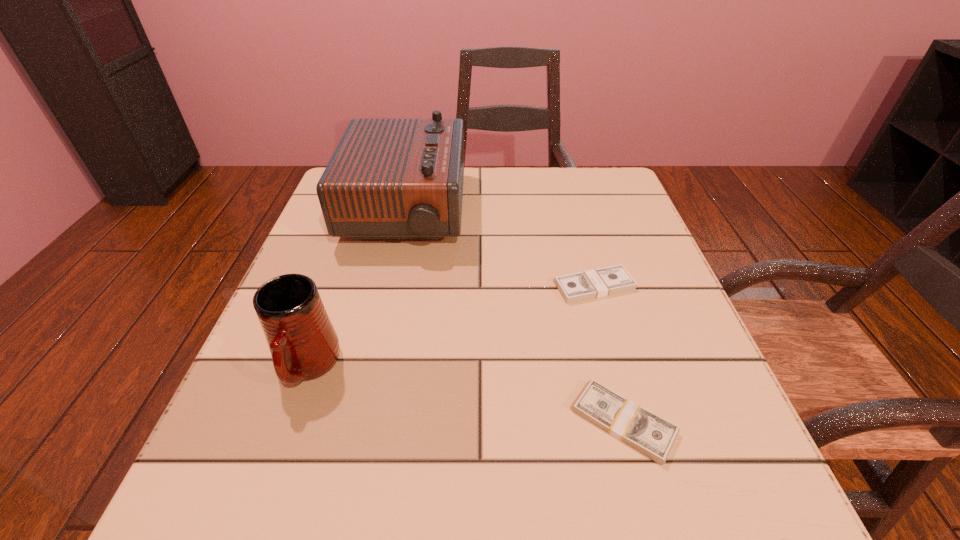
Locate an element on the screen. free region at the far right corner is located at coordinates (565, 173).

Find the location of a particular element. The image size is (960, 540). free space that is in between the second tallest object and the nearer dollar is located at coordinates (466, 394).

The height and width of the screenshot is (540, 960). In order to click on vacant space in between the nearer dollar and the tallest object in this screenshot , I will do `click(515, 316)`.

Locate an element on the screen. The image size is (960, 540). free point between the nearer dollar and the second farthest object is located at coordinates click(609, 354).

I want to click on vacant point located between the second farthest object and the third shortest object, so click(x=451, y=327).

Identify the location of vacant area between the nearer dollar and the farthest object. (515, 316).

Locate an element on the screen. The image size is (960, 540). empty location between the farther dollar and the third shortest object is located at coordinates (451, 327).

Image resolution: width=960 pixels, height=540 pixels. In order to click on vacant point located between the tallest object and the farther dollar in this screenshot , I will do click(500, 249).

This screenshot has height=540, width=960. Identify the location of vacant space in between the farthest object and the third shortest object. (356, 289).

Image resolution: width=960 pixels, height=540 pixels. In order to click on unoccupied area between the nearer dollar and the third nearest object in this screenshot , I will do `click(609, 354)`.